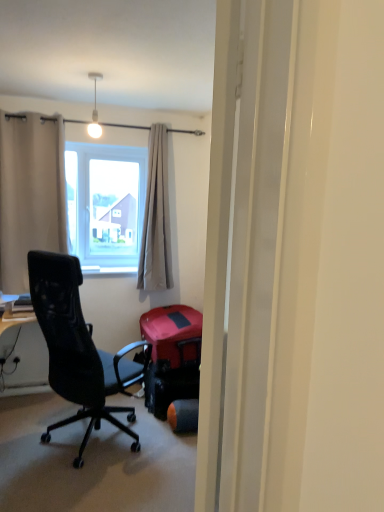
Question: Is beige fabric curtain at left, arranged as the 1th curtain when viewed from the left, positioned in front of white glossy light bulb at upper center?

Choices:
 (A) yes
 (B) no

Answer: (B)

Question: Does beige fabric curtain at left, arranged as the 1th curtain when viewed from the left, have a smaller size compared to white glossy light bulb at upper center?

Choices:
 (A) no
 (B) yes

Answer: (A)

Question: Does beige fabric curtain at left, arranged as the 1th curtain when viewed from the left, have a lesser width compared to white glossy light bulb at upper center?

Choices:
 (A) yes
 (B) no

Answer: (B)

Question: Does beige fabric curtain at left, placed as the second curtain when sorted from right to left, touch white glossy light bulb at upper center?

Choices:
 (A) no
 (B) yes

Answer: (A)

Question: From a real-world perspective, is beige fabric curtain at left, arranged as the 1th curtain when viewed from the left, over white glossy light bulb at upper center?

Choices:
 (A) yes
 (B) no

Answer: (B)

Question: From their relative heights in the image, would you say transparent plastic screen door at center is taller or shorter than light beige fabric curtain at center, the second curtain positioned from the left?

Choices:
 (A) short
 (B) tall

Answer: (A)

Question: In the image, is transparent plastic screen door at center on the left side or the right side of light beige fabric curtain at center, the second curtain positioned from the left?

Choices:
 (A) left
 (B) right

Answer: (B)

Question: From the image's perspective, is transparent plastic screen door at center positioned above or below light beige fabric curtain at center, which appears as the 1th curtain when viewed from the right?

Choices:
 (A) below
 (B) above

Answer: (A)

Question: Considering the positions of point (274, 62) and point (163, 134), is point (274, 62) closer or farther from the camera than point (163, 134)?

Choices:
 (A) farther
 (B) closer

Answer: (B)

Question: Looking at the image, does rubberized red suitcase at center seem bigger or smaller compared to beige fabric curtain at left, placed as the second curtain when sorted from right to left?

Choices:
 (A) big
 (B) small

Answer: (B)

Question: Is rubberized red suitcase at center wider or thinner than beige fabric curtain at left, placed as the second curtain when sorted from right to left?

Choices:
 (A) thin
 (B) wide

Answer: (B)

Question: In terms of height, does rubberized red suitcase at center look taller or shorter compared to beige fabric curtain at left, placed as the second curtain when sorted from right to left?

Choices:
 (A) tall
 (B) short

Answer: (B)

Question: From the image's perspective, is rubberized red suitcase at center above or below beige fabric curtain at left, placed as the second curtain when sorted from right to left?

Choices:
 (A) above
 (B) below

Answer: (B)

Question: Is light beige fabric curtain at center, the second curtain positioned from the left, in front of or behind beige fabric curtain at left, arranged as the 1th curtain when viewed from the left, in the image?

Choices:
 (A) behind
 (B) front

Answer: (A)

Question: Looking at the image, does light beige fabric curtain at center, the second curtain positioned from the left, seem bigger or smaller compared to beige fabric curtain at left, arranged as the 1th curtain when viewed from the left?

Choices:
 (A) small
 (B) big

Answer: (A)